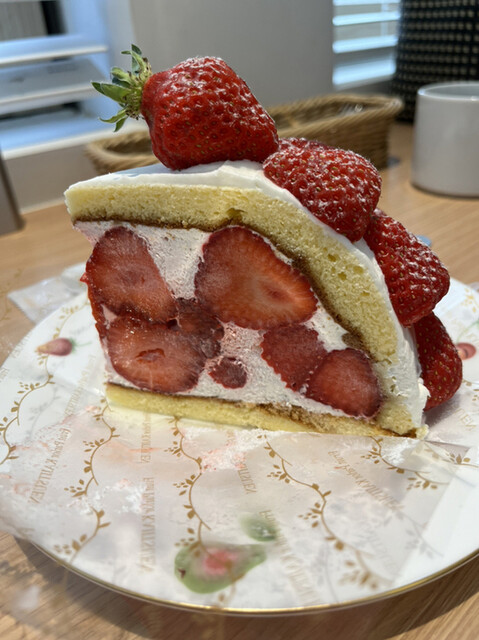
Locate an element on the screen. This screenshot has width=479, height=640. fruit designs on plate is located at coordinates (58, 349), (241, 568), (468, 352).